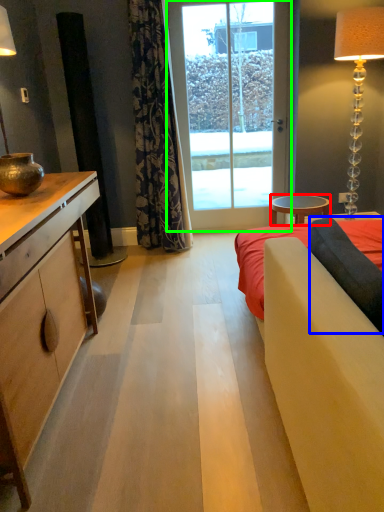
Question: Estimate the real-world distances between objects in this image. Which object is closer to table (highlighted by a red box), pillow (highlighted by a blue box) or glass door (highlighted by a green box)?

Choices:
 (A) pillow
 (B) glass door

Answer: (B)